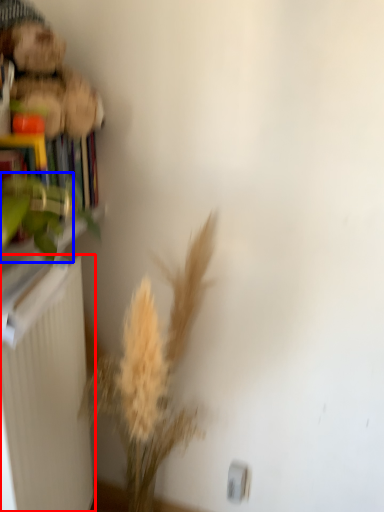
Question: Which object is closer to the camera taking this photo, radiator (highlighted by a red box) or plant (highlighted by a blue box)?

Choices:
 (A) radiator
 (B) plant

Answer: (A)